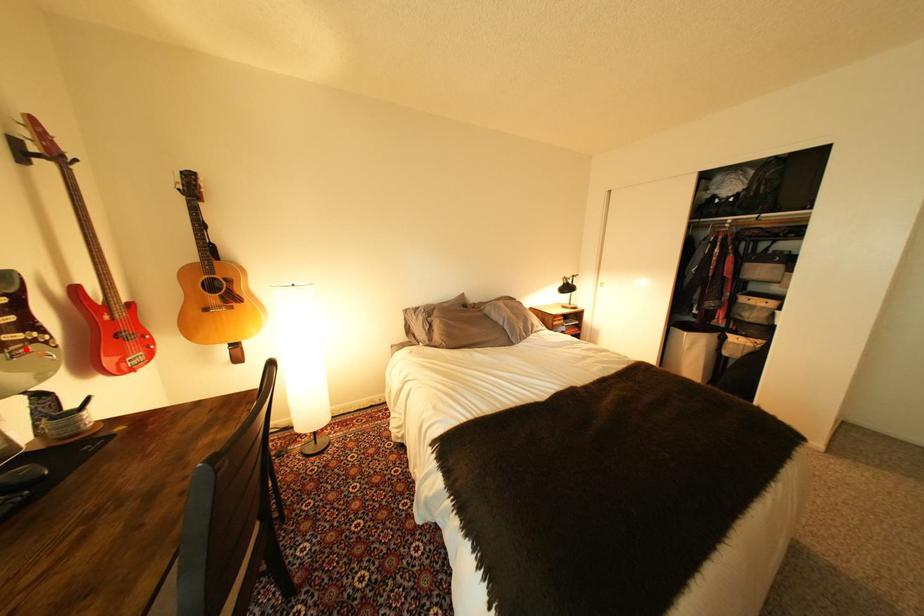
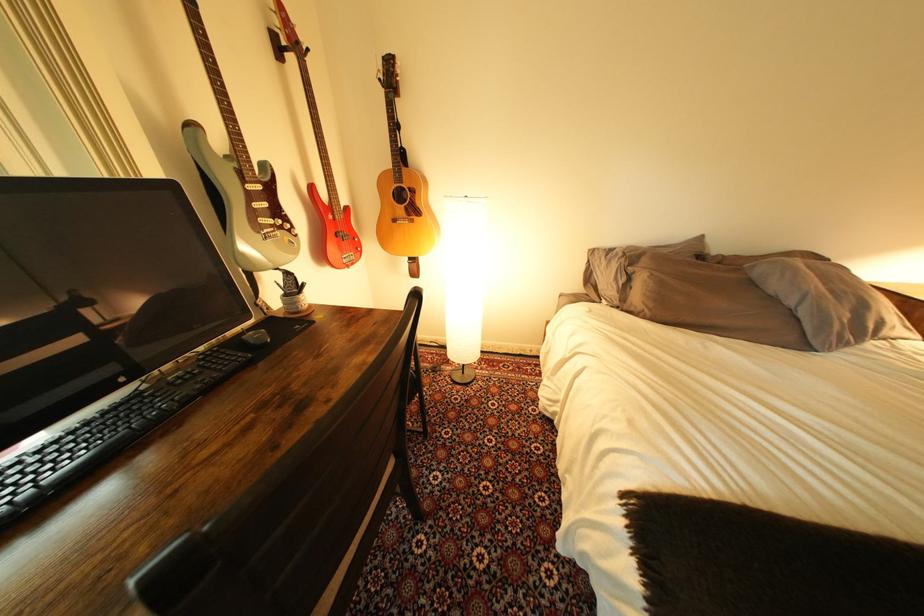
Find the pixel in the second image that matches the highlighted location in the first image.

(278, 233)